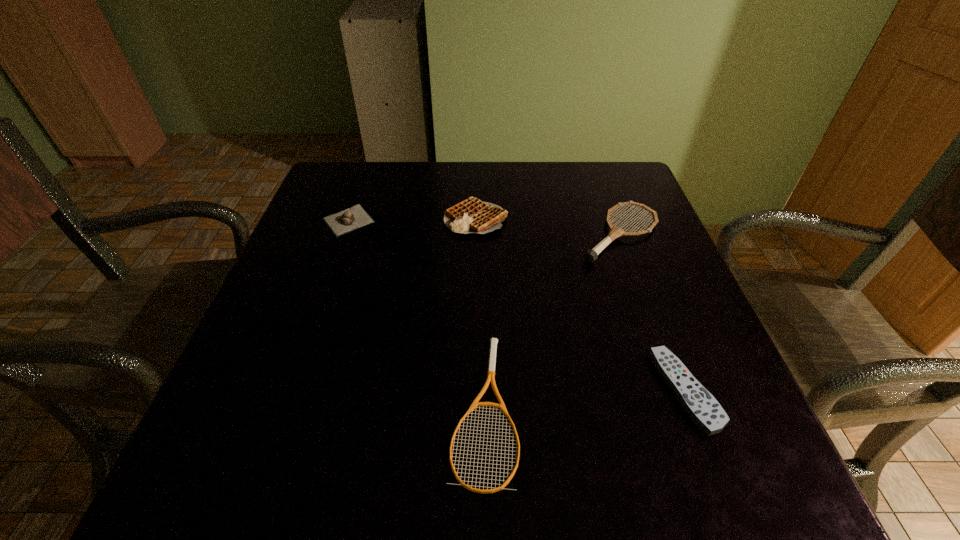
At what (x,y) coordinates should I click in order to perform the action: click on vacant area situated 0.100m on the back of the third tallest object. Please return your answer as a coordinate pair (x, y). This screenshot has height=540, width=960. Looking at the image, I should click on (362, 183).

Locate an element on the screen. vacant region located 0.080m on the front of the remote control is located at coordinates (725, 495).

Identify the location of vacant space located on the back of the nearer tennis racket. The width and height of the screenshot is (960, 540). (483, 230).

This screenshot has height=540, width=960. Find the location of `waffle positioned at the far edge`. waffle positioned at the far edge is located at coordinates (472, 215).

Image resolution: width=960 pixels, height=540 pixels. Identify the location of tennis racket at the far edge. (590, 256).

The height and width of the screenshot is (540, 960). I want to click on garlic located at the far edge, so click(353, 218).

Find the location of a particular element. The image size is (960, 540). remote control present at the near edge is located at coordinates (700, 405).

At what (x,y) coordinates should I click in order to perform the action: click on tennis racket that is at the near edge. Please return your answer as a coordinate pair (x, y). This screenshot has height=540, width=960. Looking at the image, I should click on (493, 341).

The height and width of the screenshot is (540, 960). Identify the location of object that is at the left edge. (353, 218).

Where is `tennis racket positioned at the right edge`? This screenshot has height=540, width=960. tennis racket positioned at the right edge is located at coordinates (590, 256).